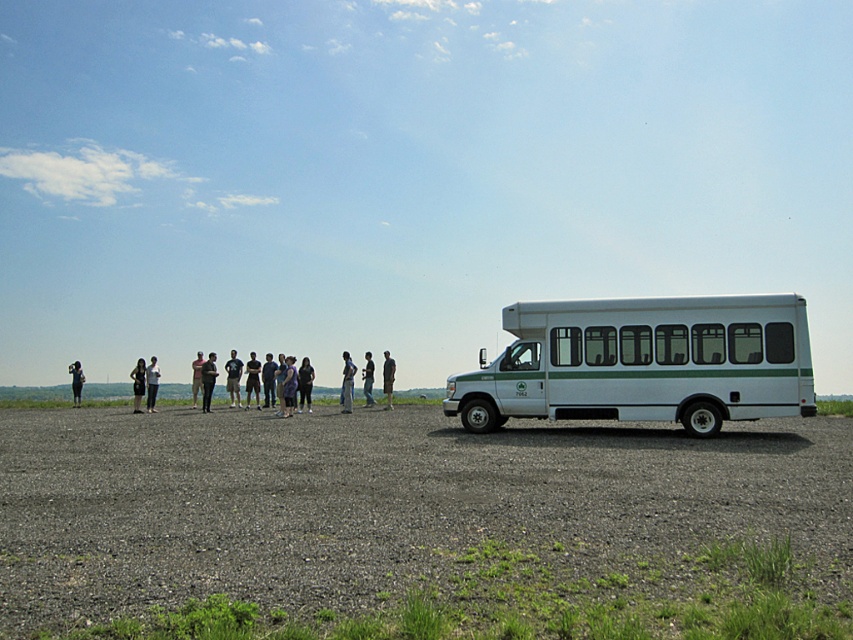
Based on the photo, is dark gray shirt at center positioned before dark gray shirt at left?

Yes, it is.

Who is positioned more to the right, dark gray shirt at center or dark gray shirt at left?

From the viewer's perspective, dark gray shirt at center appears more on the right side.

Between point (209, 410) and point (73, 368), which one is positioned in front?

Point (209, 410) is in front.

At what (x,y) coordinates should I click in order to perform the action: click on dark gray shirt at center. Please return your answer as a coordinate pair (x, y). Looking at the image, I should click on (207, 380).

Can you confirm if dark blue shirt at center is thinner than light brown fabric shirt at center?

Correct, dark blue shirt at center's width is less than light brown fabric shirt at center's.

Is point (264, 406) closer to camera compared to point (194, 394)?

Yes.

Find the location of `dark blue shirt at center`. dark blue shirt at center is located at coordinates (268, 380).

Which of these two, dark gray fabric jacket at center or dark blue shirt at center, stands shorter?

Standing shorter between the two is dark gray fabric jacket at center.

Does dark gray fabric jacket at center have a lesser width compared to dark blue shirt at center?

Yes.

Does point (310, 401) come in front of point (271, 387)?

Yes.

I want to click on dark gray fabric jacket at center, so click(x=305, y=384).